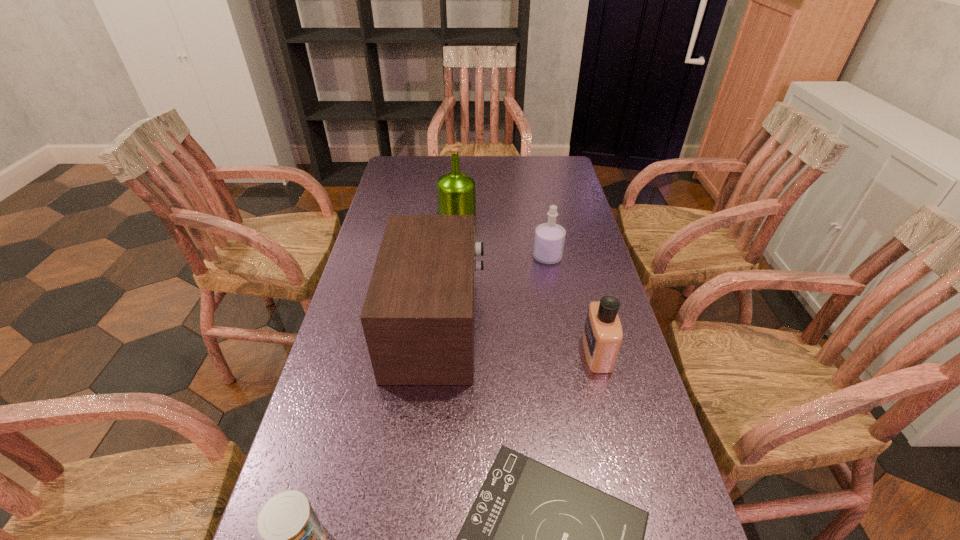
You are a GUI agent. You are given a task and a screenshot of the screen. Output one action in this format:
    pyautogui.click(x=<x>, y=<y>)
    Task: Click on the farthest object
    This screenshot has height=540, width=960.
    Given the screenshot: What is the action you would take?
    pyautogui.click(x=456, y=191)

At what (x,y) coordinates should I click in order to perform the action: click on radio receiver. Please return your answer as a coordinate pair (x, y). The width and height of the screenshot is (960, 540). Looking at the image, I should click on (418, 318).

Locate an element on the screen. This screenshot has width=960, height=540. the left perfume is located at coordinates (549, 240).

Image resolution: width=960 pixels, height=540 pixels. Identify the location of the farther perfume. (549, 240).

Where is `the right perfume`? The image size is (960, 540). the right perfume is located at coordinates (602, 336).

The image size is (960, 540). What are the coordinates of `vacant space located on the left of the farthest object` in the screenshot? It's located at (390, 211).

Locate an element on the screen. The width and height of the screenshot is (960, 540). vacant point located 0.270m on the front-facing side of the radio receiver is located at coordinates (588, 326).

This screenshot has height=540, width=960. Identify the location of vacant space located on the front of the left perfume. (564, 346).

Where is `free space located 0.110m on the front label of the right perfume`? The image size is (960, 540). free space located 0.110m on the front label of the right perfume is located at coordinates (540, 353).

The image size is (960, 540). I want to click on vacant region located on the front label of the right perfume, so click(x=424, y=353).